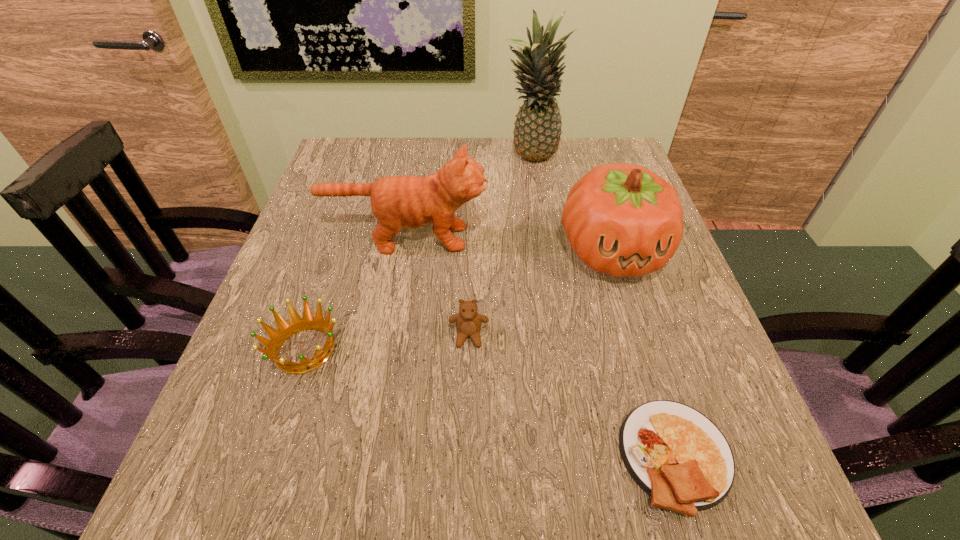
At what (x,y) coordinates should I click in order to perform the action: click on free space between the second shortest object and the farthest object. Please return your answer as a coordinate pair (x, y). This screenshot has height=540, width=960. Looking at the image, I should click on (417, 254).

You are a GUI agent. You are given a task and a screenshot of the screen. Output one action in this format:
    pyautogui.click(x=<x>, y=<y>)
    Task: Click on the free space between the teddy bear and the fifth tallest object
    
    Given the screenshot: What is the action you would take?
    pyautogui.click(x=387, y=343)

The width and height of the screenshot is (960, 540). Find the location of `free area in between the fifth tallest object and the third shortest object`. free area in between the fifth tallest object and the third shortest object is located at coordinates (387, 343).

The image size is (960, 540). In order to click on object that is the fourth closest to the pumpkin in this screenshot , I will do `click(679, 457)`.

Where is `the second closest object to the pumpkin`? This screenshot has width=960, height=540. the second closest object to the pumpkin is located at coordinates (468, 322).

The image size is (960, 540). Find the location of `vacant point that satisfies the following two spatial constraints: 1. on the side of the shortest object with the cute face; 2. on the left side of the pumpkin`. vacant point that satisfies the following two spatial constraints: 1. on the side of the shortest object with the cute face; 2. on the left side of the pumpkin is located at coordinates (675, 456).